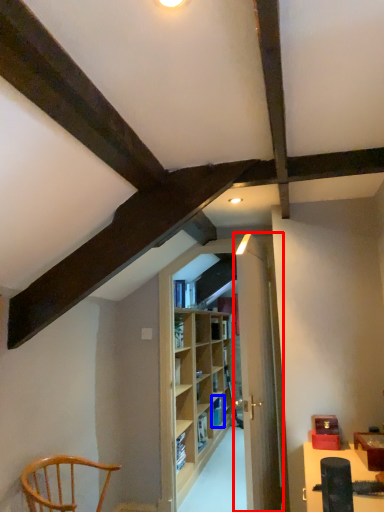
Question: Which object appears closest to the camera in this image, door (highlighted by a red box) or shelf (highlighted by a blue box)?

Choices:
 (A) door
 (B) shelf

Answer: (A)